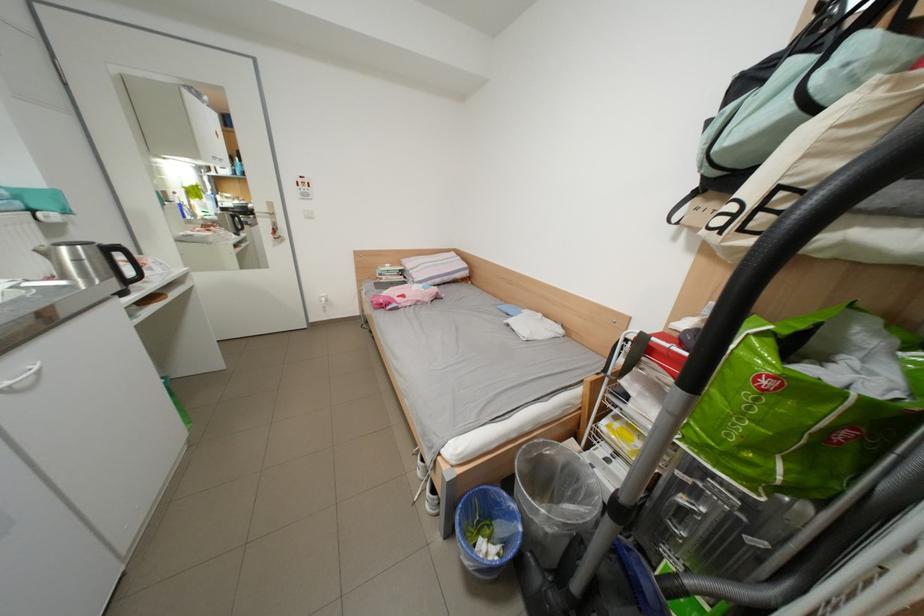
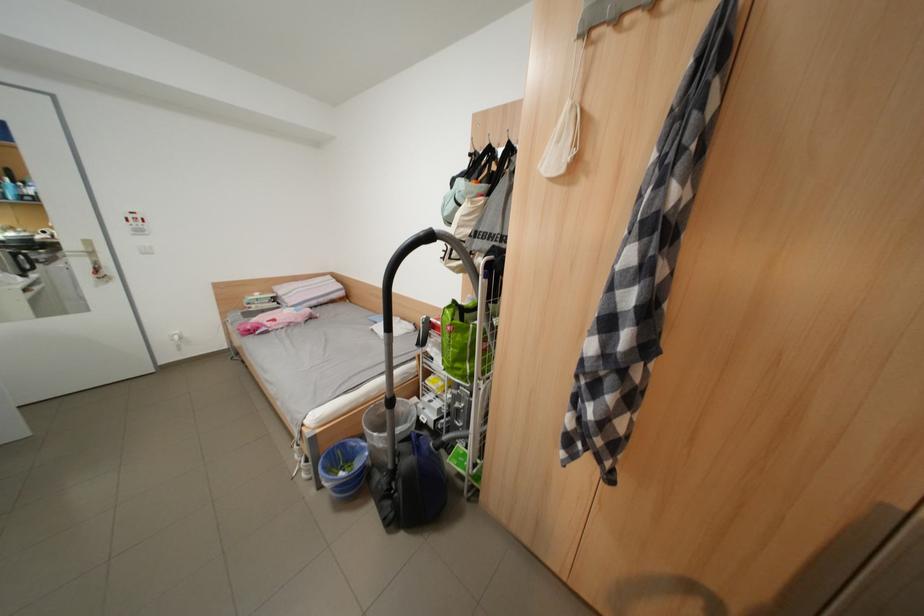
What movement of the cameraman would produce the second image?

The cameraman moved toward right, backward.